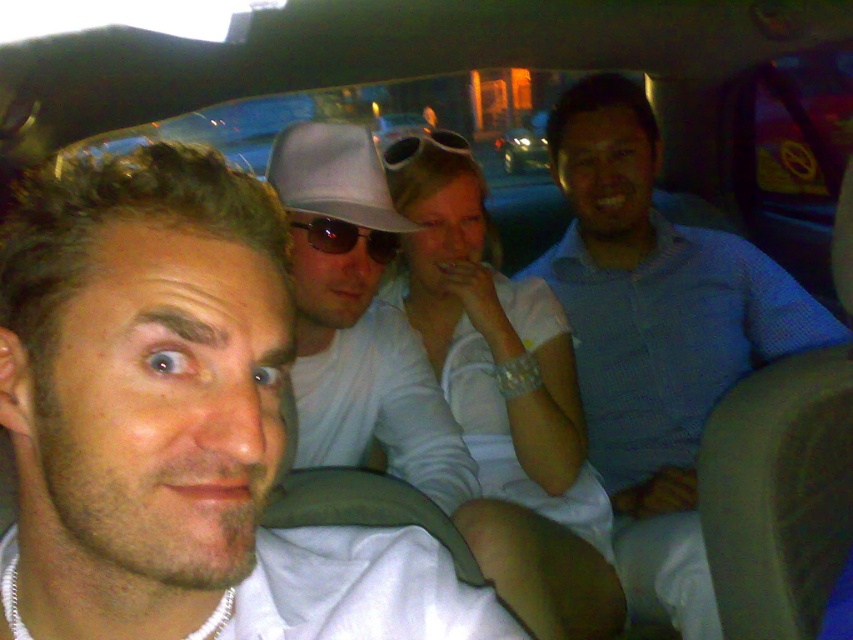
Does smooth white shirt at center appear on the left side of clear plastic goggles at center?

Yes, smooth white shirt at center is to the left of clear plastic goggles at center.

Which is in front, point (282, 262) or point (454, 141)?

Positioned in front is point (282, 262).

I want to click on smooth white shirt at center, so click(x=177, y=426).

Is clear plastic goggles at center to the right of green matte car at center from the viewer's perspective?

No, clear plastic goggles at center is not to the right of green matte car at center.

Is point (387, 170) closer to camera compared to point (538, 134)?

Yes, it is.

You are a GUI agent. You are given a task and a screenshot of the screen. Output one action in this format:
    pyautogui.click(x=<x>, y=<y>)
    Task: Click on the clear plastic goggles at center
    
    Given the screenshot: What is the action you would take?
    pos(422,147)

Looking at this image, does blue textured shirt at center have a greater height compared to green matte car at center?

Correct, blue textured shirt at center is much taller as green matte car at center.

Who is taller, blue textured shirt at center or green matte car at center?

blue textured shirt at center

Locate an element on the screen. blue textured shirt at center is located at coordinates (656, 337).